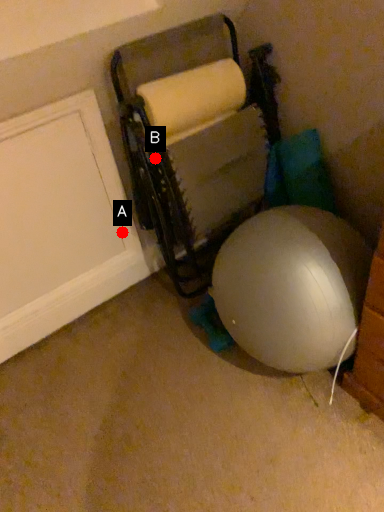
Question: Two points are circled on the image, labeled by A and B beside each circle. Among these points, which one is nearest to the camera?

Choices:
 (A) A is closer
 (B) B is closer

Answer: (B)